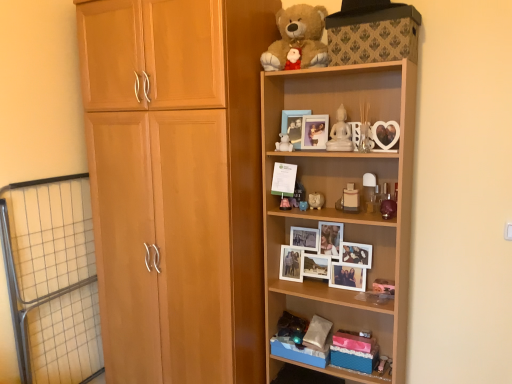
What do you see at coordinates (52, 279) in the screenshot? I see `metal grid screen door at left` at bounding box center [52, 279].

What is the approximate height of wooden shelf at upper right, the second shelf in the bottom-to-top sequence?

wooden shelf at upper right, the second shelf in the bottom-to-top sequence, is 5.36 feet tall.

The image size is (512, 384). Describe the element at coordinates (339, 198) in the screenshot. I see `wooden shelf at upper right, the second shelf in the bottom-to-top sequence` at that location.

What do you see at coordinates (350, 199) in the screenshot? I see `matte plastic perfume bottle at center, acting as the 2th toy starting from the right` at bounding box center [350, 199].

Describe the element at coordinates (177, 185) in the screenshot. The width and height of the screenshot is (512, 384). I see `light brown wood cupboard at left` at that location.

Describe the element at coordinates (364, 128) in the screenshot. I see `clear glass vase at upper center, which is the 1th toy from right to left` at that location.

You are a GUI agent. You are given a task and a screenshot of the screen. Output one action in this format:
    pyautogui.click(x=<x>, y=<y>)
    Task: Click on the metal grid screen door at left
    This screenshot has width=512, height=384.
    Given the screenshot: What is the action you would take?
    pyautogui.click(x=52, y=279)

From the picture: Considering the sizes of objects matte wooden picture frame at upper center, arranged as the 2th picture frame when viewed from the right, and wooden photo frame at upper center, placed as the first picture frame when sorted from right to left, in the image provided, who is thinner, matte wooden picture frame at upper center, arranged as the 2th picture frame when viewed from the right, or wooden photo frame at upper center, placed as the first picture frame when sorted from right to left,?

With smaller width is matte wooden picture frame at upper center, arranged as the 2th picture frame when viewed from the right.

Considering the relative sizes of matte wooden picture frame at upper center, which appears as the first picture frame when viewed from the left, and wooden photo frame at upper center, the 2th picture frame when ordered from left to right, in the image provided, is matte wooden picture frame at upper center, which appears as the first picture frame when viewed from the left, taller than wooden photo frame at upper center, the 2th picture frame when ordered from left to right,?

Indeed, matte wooden picture frame at upper center, which appears as the first picture frame when viewed from the left, has a greater height compared to wooden photo frame at upper center, the 2th picture frame when ordered from left to right.

Is matte wooden picture frame at upper center, arranged as the 2th picture frame when viewed from the right, bigger or smaller than wooden photo frame at upper center, the 2th picture frame when ordered from left to right?

matte wooden picture frame at upper center, arranged as the 2th picture frame when viewed from the right, is smaller than wooden photo frame at upper center, the 2th picture frame when ordered from left to right.

Is matte wooden picture frame at upper center, which appears as the first picture frame when viewed from the left, outside of wooden photo frame at upper center, the 2th picture frame when ordered from left to right?

That's correct, matte wooden picture frame at upper center, which appears as the first picture frame when viewed from the left, is outside of wooden photo frame at upper center, the 2th picture frame when ordered from left to right.

From the picture: Between white matte picture frames at center, which is the 2th shelf from top to bottom, and matte plastic perfume bottle at center, arranged as the 5th toy when viewed from the left, which one has larger width?

Wider between the two is matte plastic perfume bottle at center, arranged as the 5th toy when viewed from the left.

Would you consider white matte picture frames at center, which is the 2th shelf from top to bottom, to be distant from matte plastic perfume bottle at center, arranged as the 5th toy when viewed from the left?

That's not correct — white matte picture frames at center, which is the 2th shelf from top to bottom, is a little close to matte plastic perfume bottle at center, arranged as the 5th toy when viewed from the left.

Is white matte picture frames at center, which is the 2th shelf from top to bottom, in front of or behind matte plastic perfume bottle at center, acting as the 2th toy starting from the right, in the image?

Clearly, white matte picture frames at center, which is the 2th shelf from top to bottom, is behind matte plastic perfume bottle at center, acting as the 2th toy starting from the right.

Does point (265, 242) come behind point (349, 187)?

Yes, point (265, 242) is farther from viewer.

From a real-world perspective, which object stands above the other?

white matte teddy bear at upper center, marked as the 6th toy in a right-to-left arrangement, from a real-world perspective.

Is white matte teddy bear at upper center, marked as the 6th toy in a right-to-left arrangement, aimed at light brown wood cupboard at left?

No, white matte teddy bear at upper center, marked as the 6th toy in a right-to-left arrangement, does not turn towards light brown wood cupboard at left.

Which is nearer, (281, 144) or (243, 334)?

The point (243, 334) is in front.

Could patterned fabric storage box at upper center be considered to be inside metal grid screen door at left?

No, patterned fabric storage box at upper center is not surrounded by metal grid screen door at left.

Based on the photo, how far apart are metal grid screen door at left and patterned fabric storage box at upper center?

metal grid screen door at left and patterned fabric storage box at upper center are 5.10 feet apart from each other.

From a real-world perspective, between metal grid screen door at left and patterned fabric storage box at upper center, who is vertically higher?

patterned fabric storage box at upper center, from a real-world perspective.

Is metal grid screen door at left far from patterned fabric storage box at upper center?

Indeed, metal grid screen door at left is not near patterned fabric storage box at upper center.

Does matte blue piggy bank at center, the fifth toy viewed from the right, lie in front of white matte teddy bear at upper center, marked as the 1th toy in a left-to-right arrangement?

No, it is not.

From a real-world perspective, is matte blue piggy bank at center, arranged as the second toy when viewed from the left, located beneath white matte teddy bear at upper center, marked as the 6th toy in a right-to-left arrangement?

Indeed, from a real-world perspective, matte blue piggy bank at center, arranged as the second toy when viewed from the left, is positioned beneath white matte teddy bear at upper center, marked as the 6th toy in a right-to-left arrangement.

Which object is positioned more to the left, matte blue piggy bank at center, the fifth toy viewed from the right, or white matte teddy bear at upper center, marked as the 6th toy in a right-to-left arrangement?

white matte teddy bear at upper center, marked as the 6th toy in a right-to-left arrangement, is more to the left.

Measure the distance between matte blue piggy bank at center, arranged as the second toy when viewed from the left, and white matte teddy bear at upper center, marked as the 1th toy in a left-to-right arrangement.

matte blue piggy bank at center, arranged as the second toy when viewed from the left, is 10.86 inches away from white matte teddy bear at upper center, marked as the 1th toy in a left-to-right arrangement.

Could white ceramic piggy bank at center, which ranks as the fourth toy in right-to-left order, be considered to be inside light brown wood cupboard at left?

No, light brown wood cupboard at left does not contain white ceramic piggy bank at center, which ranks as the fourth toy in right-to-left order.

Is light brown wood cupboard at left to the left or to the right of white ceramic piggy bank at center, which ranks as the fourth toy in right-to-left order, in the image?

light brown wood cupboard at left is to the left of white ceramic piggy bank at center, which ranks as the fourth toy in right-to-left order.

Could you measure the distance between light brown wood cupboard at left and white ceramic piggy bank at center, which ranks as the fourth toy in right-to-left order?

light brown wood cupboard at left and white ceramic piggy bank at center, which ranks as the fourth toy in right-to-left order, are 29.83 inches apart.

Is light brown wood cupboard at left in front of or behind white ceramic piggy bank at center, the third toy when ordered from left to right, in the image?

Visually, light brown wood cupboard at left is located in front of white ceramic piggy bank at center, the third toy when ordered from left to right.

From a real-world perspective, is light brown wood cupboard at left physically above metal grid screen door at left?

Yes, from a real-world perspective, light brown wood cupboard at left is over metal grid screen door at left

Do you think light brown wood cupboard at left is within metal grid screen door at left, or outside of it?

light brown wood cupboard at left is not inside metal grid screen door at left, it's outside.

Which is more to the right, light brown wood cupboard at left or metal grid screen door at left?

From the viewer's perspective, light brown wood cupboard at left appears more on the right side.

Consider the image. How far apart are light brown wood cupboard at left and metal grid screen door at left?

light brown wood cupboard at left is 19.04 inches from metal grid screen door at left.

The width and height of the screenshot is (512, 384). There is a wooden photo frame at upper center, placed as the first picture frame when sorted from right to left. Find the location of `picture frame above it (from a real-world perspective)`. picture frame above it (from a real-world perspective) is located at coordinates (293, 125).

Find the location of a particular element. Image resolution: width=512 pixels, height=384 pixels. the 2nd shelf below when counting from the matte plastic perfume bottle at center, acting as the 2th toy starting from the right (from the image's perspective) is located at coordinates (354, 225).

From the image, which object appears to be nearer to white ceramic piggy bank at center, which ranks as the fourth toy in right-to-left order, patterned fabric storage box at upper center or clear glass vase at upper center, which is the 1th toy from right to left?

clear glass vase at upper center, which is the 1th toy from right to left.

Based on their spatial positions, is patterned fabric storage box at upper center or matte blue piggy bank at center, arranged as the second toy when viewed from the left, further from wooden photo frame at upper center, placed as the first picture frame when sorted from right to left?

The object further to wooden photo frame at upper center, placed as the first picture frame when sorted from right to left, is patterned fabric storage box at upper center.

From the image, which object appears to be farther from wooden photo frame at upper center, the 2th picture frame when ordered from left to right, matte blue piggy bank at center, arranged as the second toy when viewed from the left, or white matte picture frames at center, the first shelf ordered from the bottom?

Among the two, white matte picture frames at center, the first shelf ordered from the bottom, is located further to wooden photo frame at upper center, the 2th picture frame when ordered from left to right.

Which object lies nearer to the anchor point wooden shelf at upper right, the first shelf when ordered from top to bottom, soft brown plush at upper center or wooden photo frame at upper center, the 2th picture frame when ordered from left to right?

Based on the image, wooden photo frame at upper center, the 2th picture frame when ordered from left to right, appears to be nearer to wooden shelf at upper right, the first shelf when ordered from top to bottom.

Based on their spatial positions, is light brown wood cupboard at left or clear glass vase at upper center, acting as the 6th toy starting from the left, closer to patterned fabric storage box at upper center?

clear glass vase at upper center, acting as the 6th toy starting from the left, lies closer to patterned fabric storage box at upper center than the other object.

From the image, which object appears to be farther from soft brown plush at upper center, clear glass vase at upper center, which is the 1th toy from right to left, or white ceramic piggy bank at center, which ranks as the fourth toy in right-to-left order?

white ceramic piggy bank at center, which ranks as the fourth toy in right-to-left order, is positioned further to the anchor soft brown plush at upper center.

Looking at the image, which one is located further to white marble statue at upper center, positioned as the fourth toy in left-to-right order, matte plastic perfume bottle at center, arranged as the 5th toy when viewed from the left, or wooden shelf at upper right, the second shelf in the bottom-to-top sequence?

wooden shelf at upper right, the second shelf in the bottom-to-top sequence.

In the scene shown: When comparing their distances from patterned fabric storage box at upper center, does matte blue piggy bank at center, arranged as the second toy when viewed from the left, or white matte teddy bear at upper center, marked as the 6th toy in a right-to-left arrangement, seem further?

Based on the image, matte blue piggy bank at center, arranged as the second toy when viewed from the left, appears to be further to patterned fabric storage box at upper center.

Locate an element on the screen. Image resolution: width=512 pixels, height=384 pixels. picture frame that lies between white marble statue at upper center, positioned as the fourth toy in left-to-right order, and white ceramic piggy bank at center, the third toy when ordered from left to right, from top to bottom is located at coordinates (314, 131).

The height and width of the screenshot is (384, 512). Find the location of `cupboard situated between metal grid screen door at left and matte wooden picture frame at upper center, which appears as the first picture frame when viewed from the left, from left to right`. cupboard situated between metal grid screen door at left and matte wooden picture frame at upper center, which appears as the first picture frame when viewed from the left, from left to right is located at coordinates (177, 185).

The height and width of the screenshot is (384, 512). In order to click on shelf between white matte teddy bear at upper center, marked as the 1th toy in a left-to-right arrangement, and white matte picture frames at center, the first shelf ordered from the bottom, from top to bottom in this screenshot , I will do (339, 198).

Locate an element on the screen. cupboard located between metal grid screen door at left and patterned fabric storage box at upper center in the left-right direction is located at coordinates (177, 185).